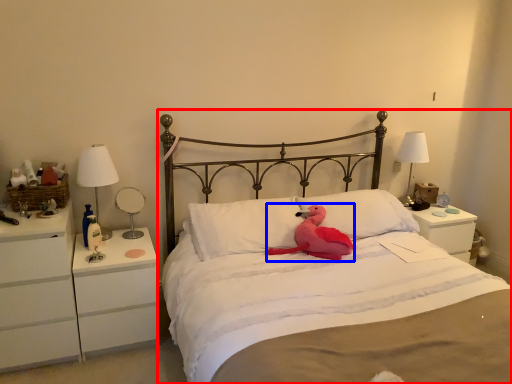
Question: Which point is further to the camera, bed (highlighted by a red box) or animal (highlighted by a blue box)?

Choices:
 (A) bed
 (B) animal

Answer: (B)